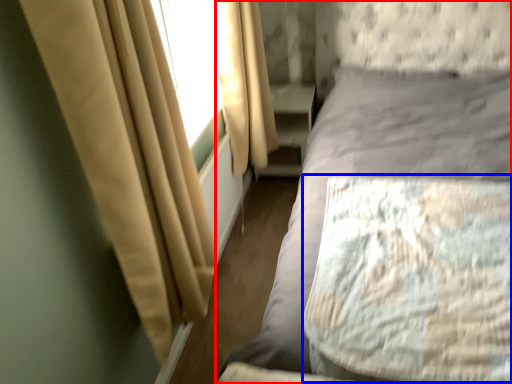
Question: Which of the following is the closest to the observer, bed (highlighted by a red box) or mattress (highlighted by a blue box)?

Choices:
 (A) bed
 (B) mattress

Answer: (A)